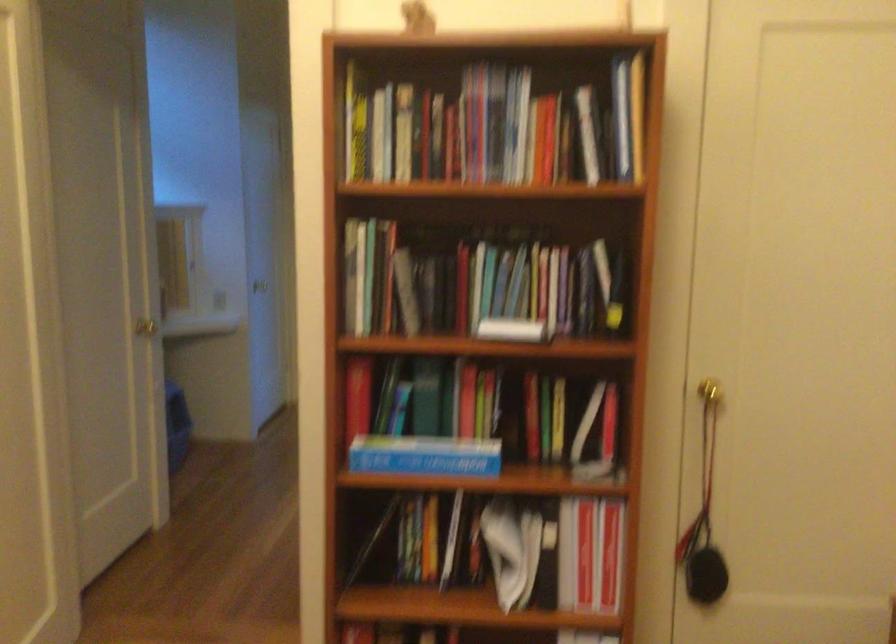
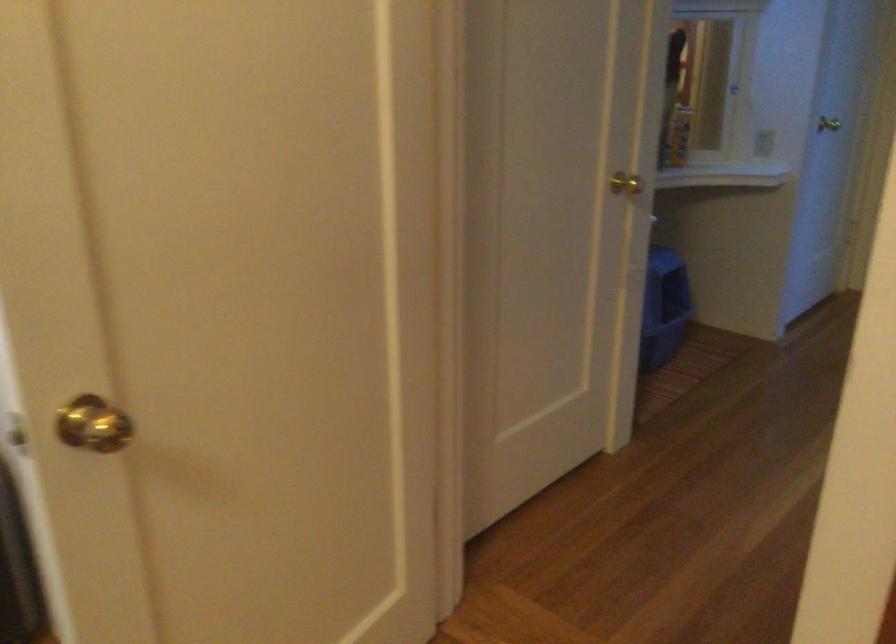
Where in the second image is the point corresponding to point (231, 299) from the first image?

(762, 143)